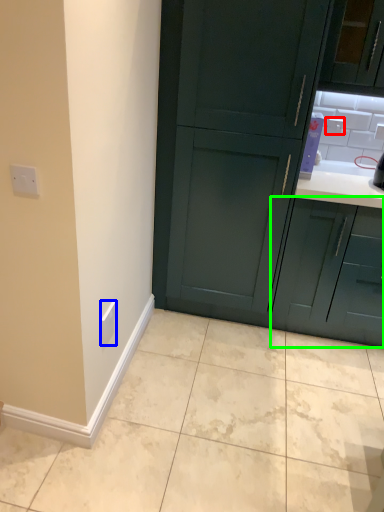
Question: Considering the real-world distances, which object is farthest from electric outlet (highlighted by a red box)? electric outlet (highlighted by a blue box) or cabinetry (highlighted by a green box)?

Choices:
 (A) electric outlet
 (B) cabinetry

Answer: (A)